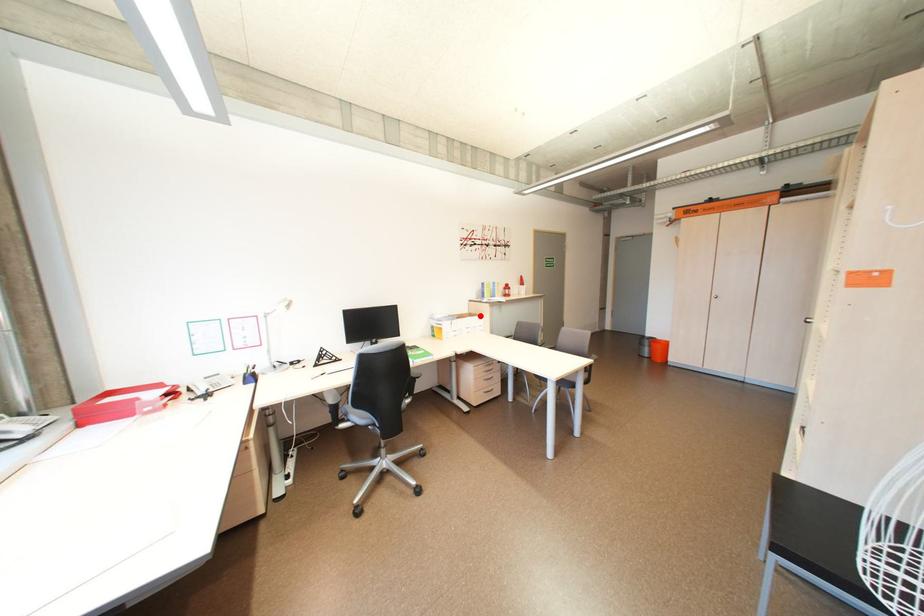
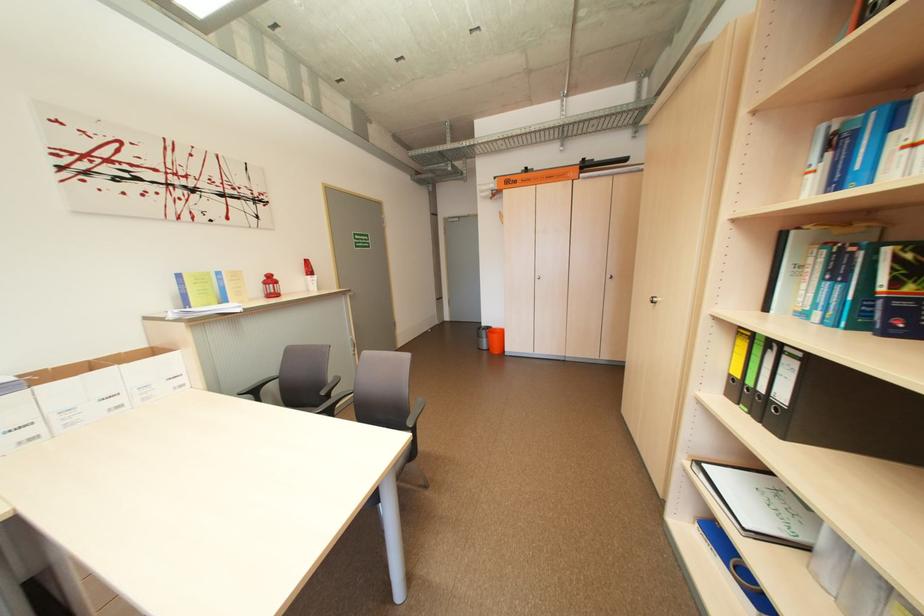
Locate, in the second image, the point that corresponds to the highlighted location in the first image.

(163, 353)